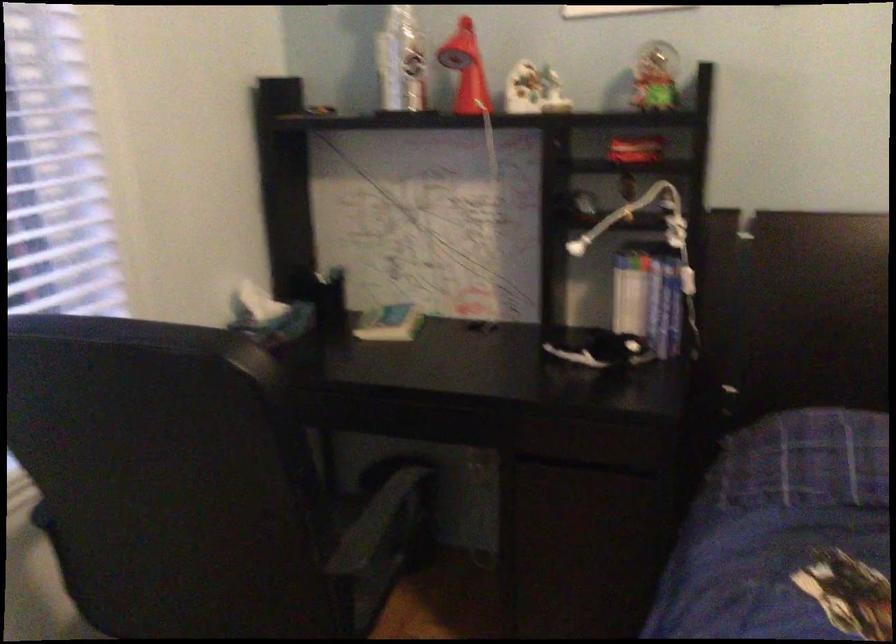
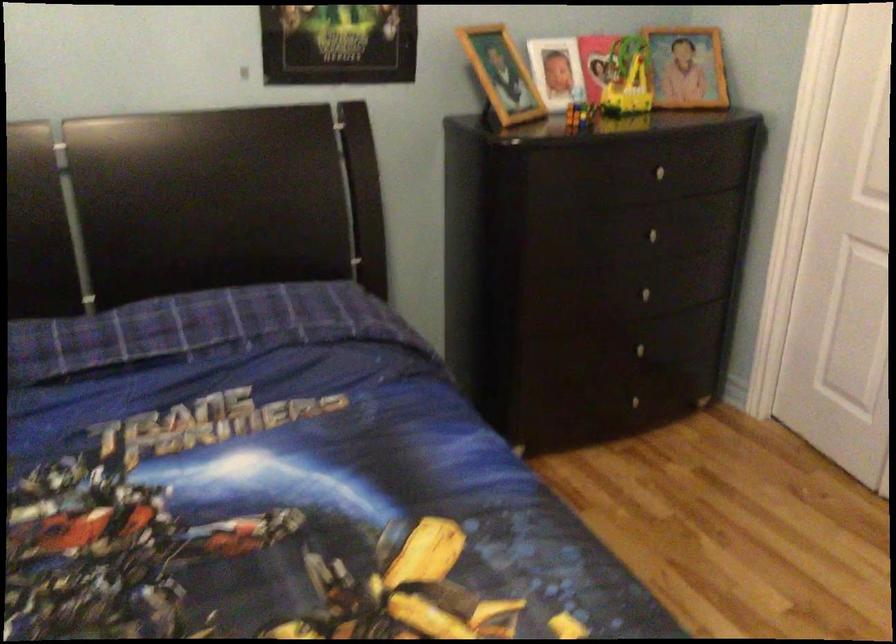
Question: How did the camera likely rotate?

Choices:
 (A) Left
 (B) Right
 (C) Up
 (D) Down

Answer: (B)